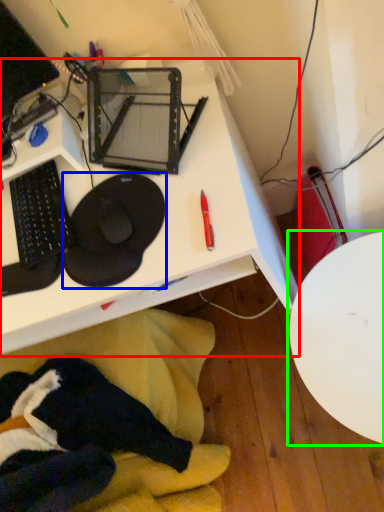
Question: Considering the real-world distances, which object is closest to desk (highlighted by a red box)? sit (highlighted by a blue box) or table (highlighted by a green box).

Choices:
 (A) sit
 (B) table

Answer: (A)